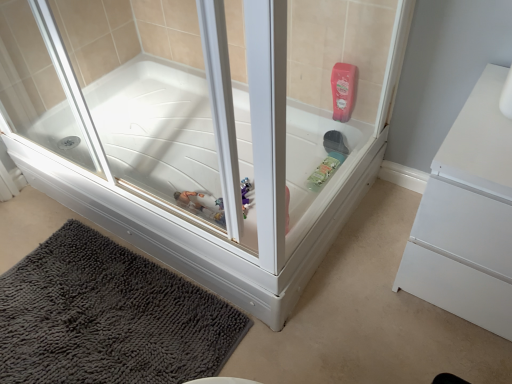
Question: Is dark gray shaggy bath mat at lower left closer to camera compared to white matte dresser at right?

Choices:
 (A) yes
 (B) no

Answer: (B)

Question: From the image's perspective, is dark gray shaggy bath mat at lower left under white matte dresser at right?

Choices:
 (A) yes
 (B) no

Answer: (A)

Question: Considering the relative positions of dark gray shaggy bath mat at lower left and white matte dresser at right in the image provided, is dark gray shaggy bath mat at lower left to the right of white matte dresser at right from the viewer's perspective?

Choices:
 (A) no
 (B) yes

Answer: (A)

Question: Is the position of dark gray shaggy bath mat at lower left more distant than that of white matte dresser at right?

Choices:
 (A) yes
 (B) no

Answer: (A)

Question: Does dark gray shaggy bath mat at lower left have a lesser height compared to white matte dresser at right?

Choices:
 (A) no
 (B) yes

Answer: (B)

Question: Is white matte dresser at right in front of or behind white glossy bathtub at center in the image?

Choices:
 (A) behind
 (B) front

Answer: (A)

Question: From the image's perspective, is white matte dresser at right above or below white glossy bathtub at center?

Choices:
 (A) below
 (B) above

Answer: (A)

Question: Is white matte dresser at right inside the boundaries of white glossy bathtub at center, or outside?

Choices:
 (A) inside
 (B) outside

Answer: (B)

Question: Is point (458, 307) closer or farther from the camera than point (326, 183)?

Choices:
 (A) farther
 (B) closer

Answer: (B)

Question: Is dark gray shaggy bath mat at lower left inside or outside of white matte dresser at right?

Choices:
 (A) inside
 (B) outside

Answer: (B)

Question: In terms of size, does dark gray shaggy bath mat at lower left appear bigger or smaller than white matte dresser at right?

Choices:
 (A) big
 (B) small

Answer: (B)

Question: Visually, is dark gray shaggy bath mat at lower left positioned to the left or to the right of white matte dresser at right?

Choices:
 (A) left
 (B) right

Answer: (A)

Question: Is point (6, 375) closer or farther from the camera than point (449, 223)?

Choices:
 (A) farther
 (B) closer

Answer: (A)

Question: From a real-world perspective, is white glossy bathtub at center positioned above or below white matte dresser at right?

Choices:
 (A) above
 (B) below

Answer: (A)

Question: Is point click(281, 274) positioned closer to the camera than point click(471, 243)?

Choices:
 (A) farther
 (B) closer

Answer: (A)